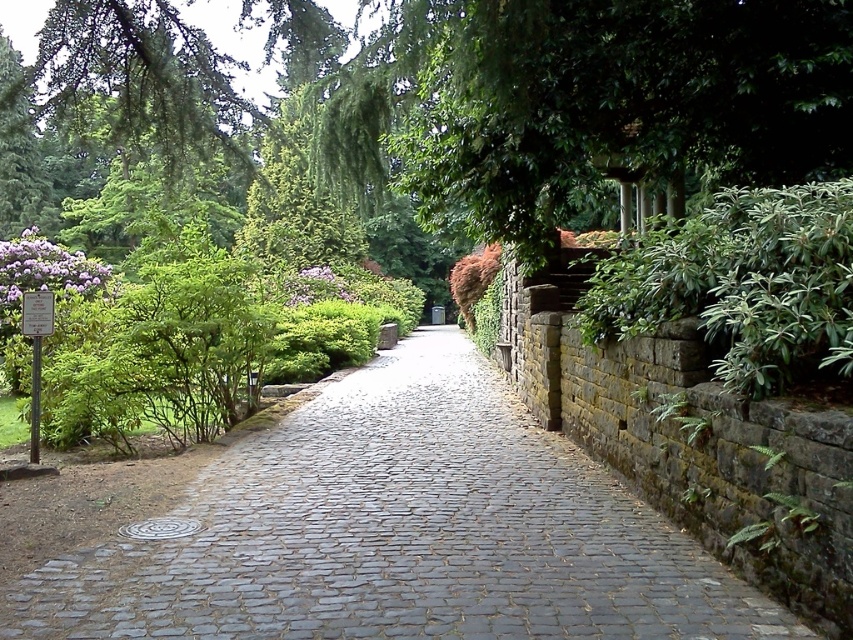
Question: Does gray cobblestone pavement at center appear on the left side of green leafy bush at right?

Choices:
 (A) yes
 (B) no

Answer: (A)

Question: Can you confirm if gray cobblestone pavement at center is positioned to the right of green leafy bush at right?

Choices:
 (A) yes
 (B) no

Answer: (B)

Question: Which point is closer to the camera?

Choices:
 (A) (703, 627)
 (B) (624, 317)

Answer: (A)

Question: Where is gray cobblestone pavement at center located in relation to green leafy bush at right in the image?

Choices:
 (A) left
 (B) right

Answer: (A)

Question: Which of the following is the closest to the observer?

Choices:
 (A) (514, 440)
 (B) (759, 358)

Answer: (B)